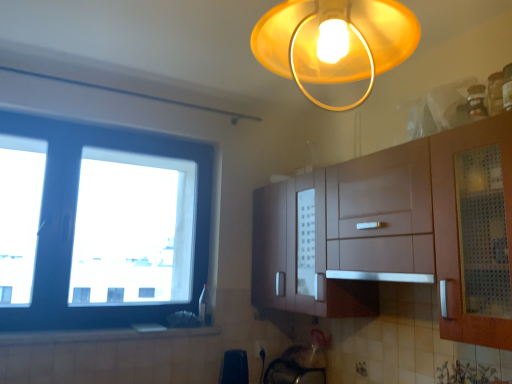
At what (x,y) coordinates should I click in order to perform the action: click on vacant point above white glossy countertop at lower left (from a real-world perspective). Please return your answer as a coordinate pair (x, y). The height and width of the screenshot is (384, 512). Looking at the image, I should click on (127, 327).